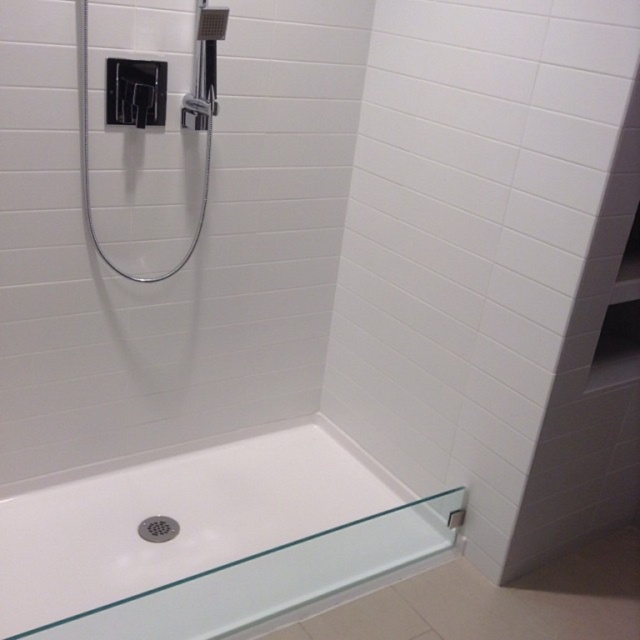
Question: Estimate the real-world distances between objects in this image. Which object is farther from the black matte shower door at upper left?

Choices:
 (A) white glossy bathtub at lower center
 (B) matte chrome showerhead at upper left

Answer: (A)

Question: Does black matte shower door at upper left have a smaller size compared to matte chrome showerhead at upper left?

Choices:
 (A) no
 (B) yes

Answer: (A)

Question: Among these points, which one is farthest from the camera?

Choices:
 (A) (1, 544)
 (B) (132, 100)
 (C) (209, 20)

Answer: (A)

Question: Which point is closer to the camera taking this photo?

Choices:
 (A) (196, 38)
 (B) (214, 58)

Answer: (B)

Question: Can you confirm if white glossy bathtub at lower center is wider than matte chrome showerhead at upper left?

Choices:
 (A) no
 (B) yes

Answer: (B)

Question: Does white glossy bathtub at lower center have a larger size compared to black matte shower door at upper left?

Choices:
 (A) no
 (B) yes

Answer: (B)